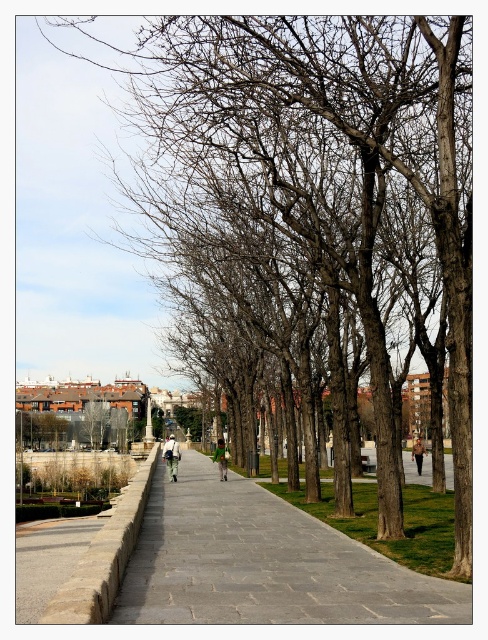
Question: Which of the following is the farthest from the observer?

Choices:
 (A) khaki cotton jacket at center
 (B) green fabric backpack at center
 (C) gray stone pavement at center
 (D) green fabric bag at center

Answer: (A)

Question: Where is green fabric backpack at center located in relation to khaki cotton jacket at center in the image?

Choices:
 (A) right
 (B) left

Answer: (B)

Question: Which of the following is the farthest from the observer?

Choices:
 (A) (169, 440)
 (B) (222, 477)

Answer: (A)

Question: Which point is closer to the camera?

Choices:
 (A) (196, 582)
 (B) (222, 476)
 (C) (168, 472)
 (D) (422, 444)

Answer: (A)

Question: Is gray stone pavement at center above green fabric bag at center?

Choices:
 (A) yes
 (B) no

Answer: (B)

Question: Does gray stone pavement at center have a smaller size compared to green fabric bag at center?

Choices:
 (A) no
 (B) yes

Answer: (A)